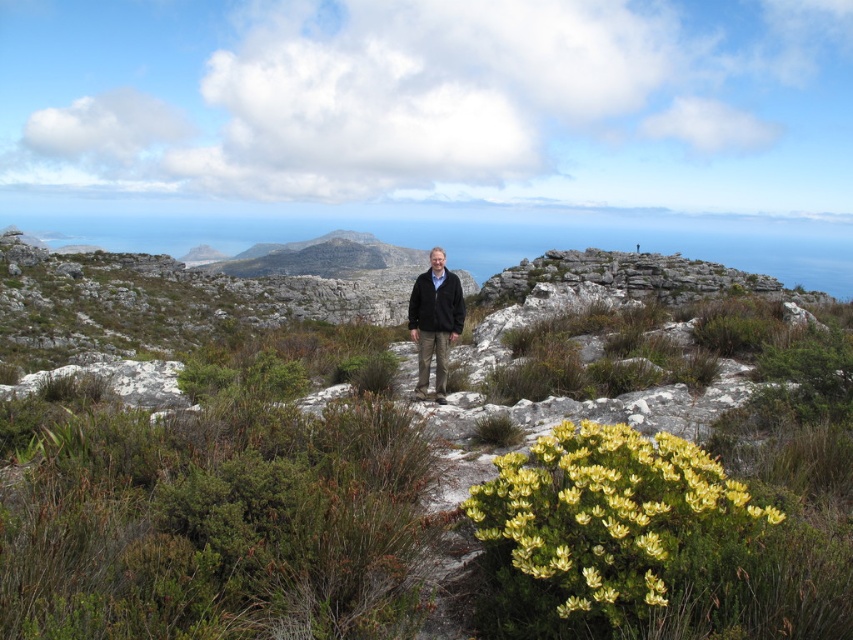
You are a hiker preparing to ascend a steep rocky path. You have two jackets, the dark brown leather jacket at center and the black fleece jacket at center. Which jacket should you choose if you want the one that reaches below your waist for better lower back protection?

The dark brown leather jacket at center is much taller than the black fleece jacket at center, so it would provide better lower back protection as it reaches below the waist.

You are a hiker preparing to take a photo of the dark brown leather jacket at center and the black fleece jacket at center. Which jacket should you focus on first if you want to capture both clearly in the same frame?

The dark brown leather jacket at center is positioned under the black fleece jacket at center, so you should focus on the black fleece jacket at center first to ensure both are in focus.